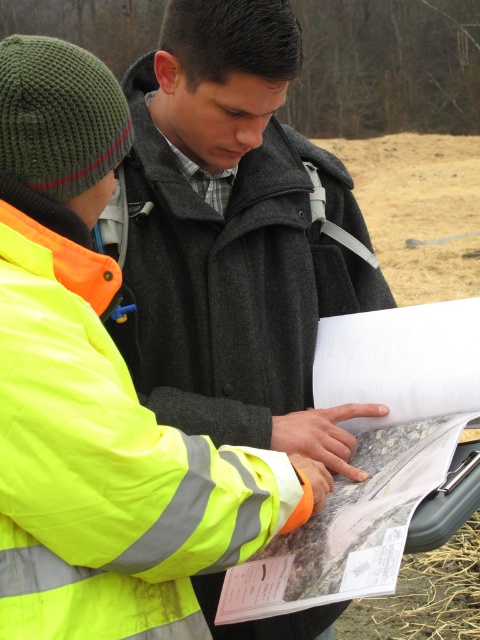
Question: Estimate the real-world distances between objects in this image. Which object is closer to the white paper at center?

Choices:
 (A) neon yellow reflective jacket at left
 (B) matte gray coat at center

Answer: (B)

Question: Based on their relative distances, which object is farther from the matte gray coat at center?

Choices:
 (A) neon yellow reflective jacket at left
 (B) white paper at center

Answer: (A)

Question: Is matte gray coat at center thinner than white paper at center?

Choices:
 (A) yes
 (B) no

Answer: (B)

Question: Is neon yellow reflective jacket at left to the right of matte gray coat at center from the viewer's perspective?

Choices:
 (A) no
 (B) yes

Answer: (A)

Question: Is neon yellow reflective jacket at left positioned before matte gray coat at center?

Choices:
 (A) no
 (B) yes

Answer: (B)

Question: Which point is closer to the camera?

Choices:
 (A) (152, 148)
 (B) (468, 404)

Answer: (B)